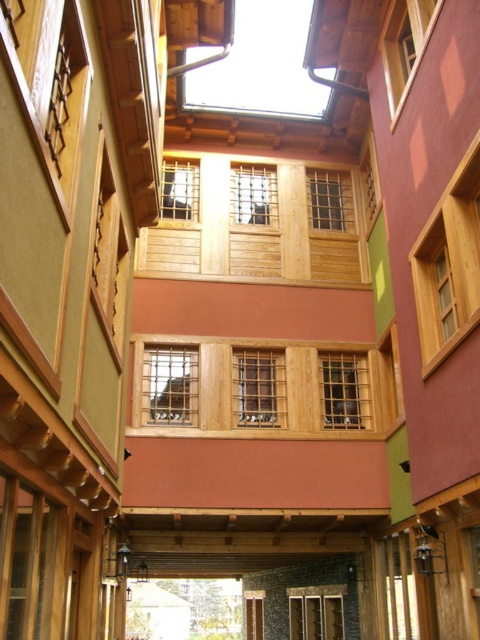
Between wooden balcony at center and natural wood balcony at center, which one appears on the left side from the viewer's perspective?

Positioned to the left is natural wood balcony at center.

Can you confirm if wooden balcony at center is taller than natural wood balcony at center?

In fact, wooden balcony at center may be shorter than natural wood balcony at center.

Find the location of a particular element. wooden balcony at center is located at coordinates (264, 387).

You are a GUI agent. You are given a task and a screenshot of the screen. Output one action in this format:
    pyautogui.click(x=<x>, y=<y>)
    Task: Click on the wooden balcony at center
    Image resolution: width=480 pixels, height=640 pixels.
    Given the screenshot: What is the action you would take?
    (x=264, y=387)